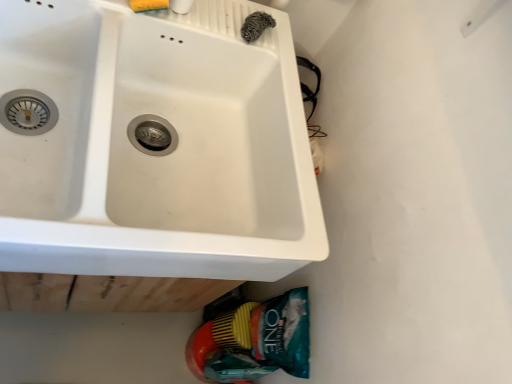
Measure the distance between white ceramic sink at upper left and camera.

white ceramic sink at upper left is 23.16 inches from camera.

Describe the element at coordinates (157, 156) in the screenshot. I see `white ceramic sink at upper left` at that location.

Where is `white ceramic sink at upper left`? white ceramic sink at upper left is located at coordinates (157, 156).

In order to click on white ceramic sink at upper left in this screenshot , I will do `click(157, 156)`.